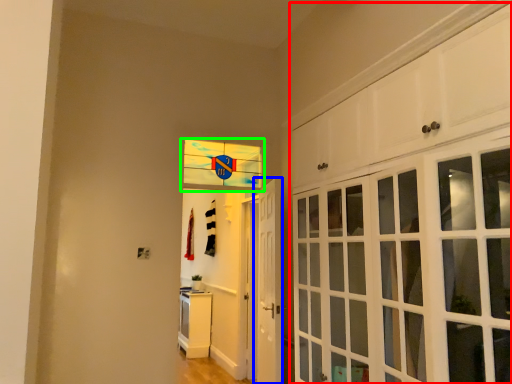
Question: Which object is positioned closest to cabinetry (highlighted by a red box)? Select from door (highlighted by a blue box) and window (highlighted by a green box).

Choices:
 (A) door
 (B) window

Answer: (A)